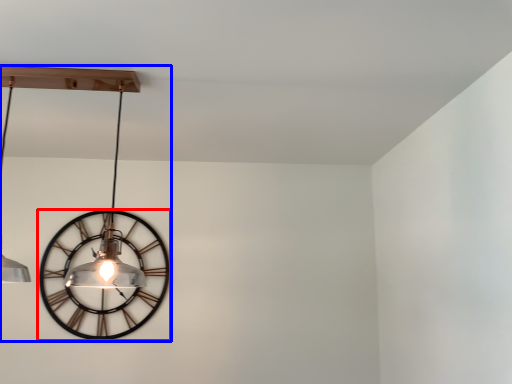
Question: Which object appears closest to the camera in this image, wall clock (highlighted by a red box) or lamp (highlighted by a blue box)?

Choices:
 (A) wall clock
 (B) lamp

Answer: (B)